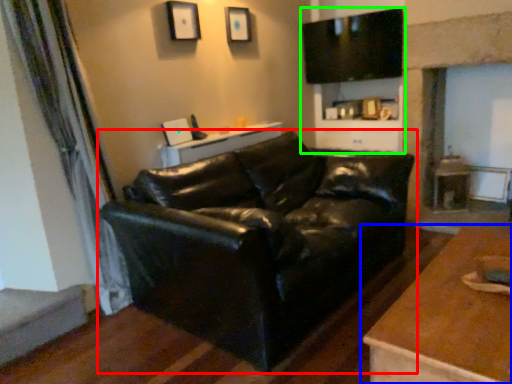
Question: Estimate the real-world distances between objects in this image. Which object is farther from studio couch (highlighted by a red box), table (highlighted by a blue box) or entertainment center (highlighted by a green box)?

Choices:
 (A) table
 (B) entertainment center

Answer: (B)